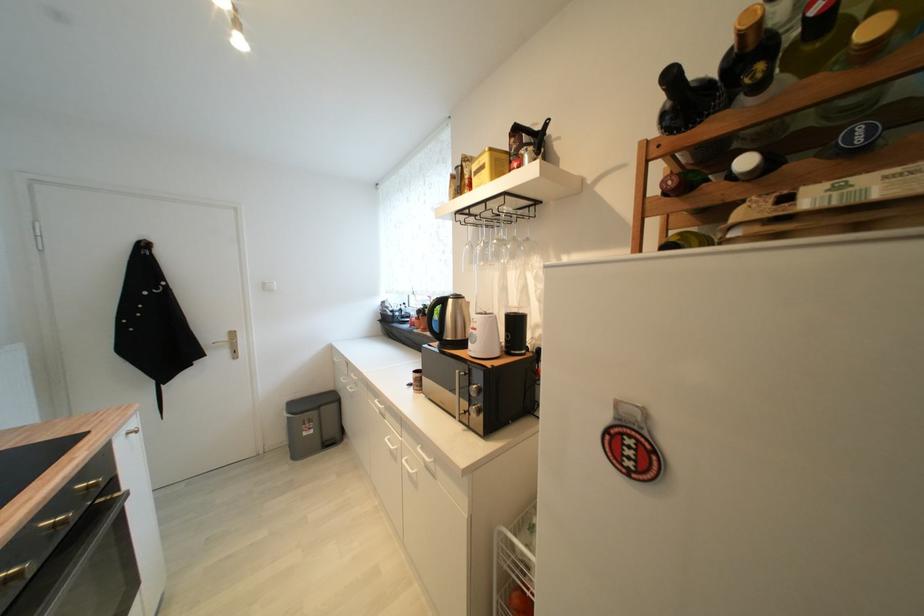
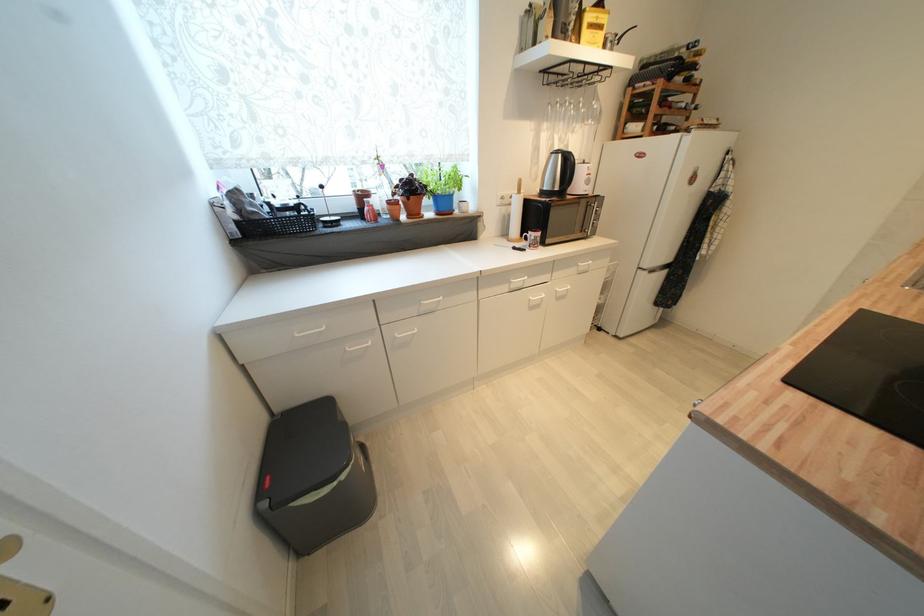
The point at (x=386, y=315) is marked in the first image. Where is the corresponding point in the second image?

(242, 225)